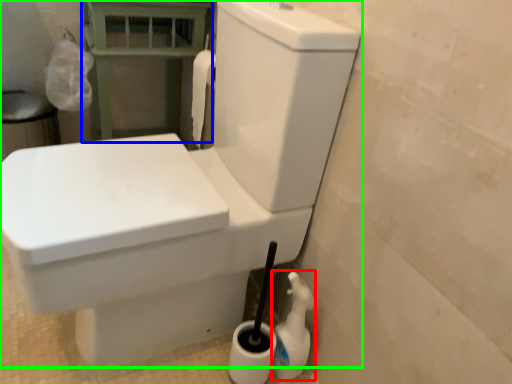
Question: Which object is the closest to the cleaning product (highlighted by a red box)? Choose among these: balustrade (highlighted by a blue box) or toilet (highlighted by a green box).

Choices:
 (A) balustrade
 (B) toilet

Answer: (B)